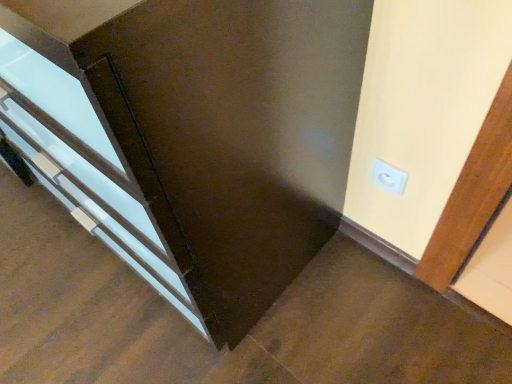
Question: Considering the positions of point (188, 195) and point (385, 168), is point (188, 195) closer or farther from the camera than point (385, 168)?

Choices:
 (A) closer
 (B) farther

Answer: (A)

Question: From their relative heights in the image, would you say matte white door at center is taller or shorter than white plastic outlet at upper right?

Choices:
 (A) tall
 (B) short

Answer: (A)

Question: Is matte white door at center wider or thinner than white plastic outlet at upper right?

Choices:
 (A) wide
 (B) thin

Answer: (A)

Question: Does point (401, 188) appear closer or farther from the camera than point (146, 11)?

Choices:
 (A) closer
 (B) farther

Answer: (B)

Question: Considering their positions, is white plastic outlet at upper right located in front of or behind matte white door at center?

Choices:
 (A) behind
 (B) front

Answer: (A)

Question: From a real-world perspective, is white plastic outlet at upper right physically located above or below matte white door at center?

Choices:
 (A) above
 (B) below

Answer: (B)

Question: Considering the positions of white plastic outlet at upper right and matte white door at center in the image, is white plastic outlet at upper right wider or thinner than matte white door at center?

Choices:
 (A) wide
 (B) thin

Answer: (B)